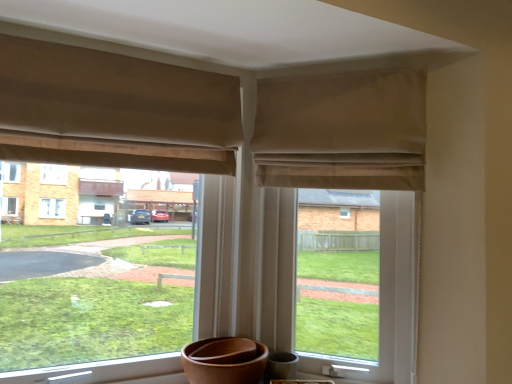
Where is `beige fabric curtain at upper left, the second curtain in the right-to-left sequence`? Image resolution: width=512 pixels, height=384 pixels. beige fabric curtain at upper left, the second curtain in the right-to-left sequence is located at coordinates (219, 116).

Locate an element on the screen. This screenshot has height=384, width=512. beige fabric curtain at upper center, which is counted as the first curtain, starting from the right is located at coordinates (341, 131).

Image resolution: width=512 pixels, height=384 pixels. Find the location of `beige fabric window at center`. beige fabric window at center is located at coordinates (99, 311).

What's the angular difference between beige fabric at upper center and beige fabric curtain at upper left, which appears as the 1th curtain when viewed from the left,'s facing directions?

The angular difference between beige fabric at upper center and beige fabric curtain at upper left, which appears as the 1th curtain when viewed from the left, is 45.4 degrees.

In order to click on curtain that is the 2nd object located above the beige fabric at upper center (from the image's perspective) in this screenshot , I will do `click(219, 116)`.

Considering the sizes of objects beige fabric at upper center and beige fabric curtain at upper left, which appears as the 1th curtain when viewed from the left, in the image provided, who is bigger, beige fabric at upper center or beige fabric curtain at upper left, which appears as the 1th curtain when viewed from the left,?

With larger size is beige fabric at upper center.

Is beige fabric at upper center positioned before beige fabric curtain at upper left, which appears as the 1th curtain when viewed from the left?

No.

Is point (362, 287) positioned behind point (380, 136)?

Yes, it is.

You are a GUI agent. You are given a task and a screenshot of the screen. Output one action in this format:
    pyautogui.click(x=<x>, y=<y>)
    Task: Click on the window screen beneath the beige fabric curtain at upper center, which is counted as the first curtain, starting from the right (from a real-world perspective)
    The height and width of the screenshot is (384, 512).
    Given the screenshot: What is the action you would take?
    click(x=341, y=259)

Is beige fabric at upper center oriented away from beige fabric curtain at upper center, which is counted as the first curtain, starting from the right?

Correct, beige fabric at upper center is looking away from beige fabric curtain at upper center, which is counted as the first curtain, starting from the right.

Is beige fabric at upper center beside beige fabric window at center?

No.

Consider the image. Do you think beige fabric at upper center is within beige fabric window at center, or outside of it?

beige fabric at upper center is not enclosed by beige fabric window at center.

From the image's perspective, between beige fabric at upper center and beige fabric window at center, who is located below?

beige fabric at upper center appears lower in the image.

From a real-world perspective, between beige fabric at upper center and beige fabric window at center, who is vertically lower?

In real-world perspective, beige fabric window at center is lower.

From the image's perspective, is beige fabric curtain at upper center, which is counted as the first curtain, starting from the right, above beige fabric window at center?

Indeed, from the image's perspective, beige fabric curtain at upper center, which is counted as the first curtain, starting from the right, is shown above beige fabric window at center.

Can you tell me how much beige fabric curtain at upper center, which is counted as the first curtain, starting from the right, and beige fabric window at center differ in facing direction?

They differ by 44.7 degrees in their facing directions.

Considering the sizes of objects beige fabric curtain at upper center, which is the 2th curtain in left-to-right order, and beige fabric window at center in the image provided, who is thinner, beige fabric curtain at upper center, which is the 2th curtain in left-to-right order, or beige fabric window at center?

beige fabric curtain at upper center, which is the 2th curtain in left-to-right order.

Is point (370, 112) closer or farther from the camera than point (33, 147)?

Point (370, 112).

Considering the sizes of objects beige fabric curtain at upper left, the second curtain in the right-to-left sequence, and beige fabric window at center in the image provided, who is shorter, beige fabric curtain at upper left, the second curtain in the right-to-left sequence, or beige fabric window at center?

beige fabric curtain at upper left, the second curtain in the right-to-left sequence, is shorter.

Considering the relative sizes of beige fabric curtain at upper left, the second curtain in the right-to-left sequence, and beige fabric window at center in the image provided, is beige fabric curtain at upper left, the second curtain in the right-to-left sequence, thinner than beige fabric window at center?

Yes, beige fabric curtain at upper left, the second curtain in the right-to-left sequence, is thinner than beige fabric window at center.

Is beige fabric curtain at upper left, the second curtain in the right-to-left sequence, not inside beige fabric window at center?

Indeed, beige fabric curtain at upper left, the second curtain in the right-to-left sequence, is completely outside beige fabric window at center.

Could you measure the distance between beige fabric curtain at upper left, which appears as the 1th curtain when viewed from the left, and beige fabric window at center?

They are 37.84 inches apart.

Is beige fabric window at center far away from beige fabric curtain at upper center, which is the 2th curtain in left-to-right order?

No, there isn't a large distance between beige fabric window at center and beige fabric curtain at upper center, which is the 2th curtain in left-to-right order.

From the image's perspective, who appears lower, beige fabric window at center or beige fabric curtain at upper center, which is the 2th curtain in left-to-right order?

beige fabric window at center, from the image's perspective.

Is beige fabric window at center inside the boundaries of beige fabric curtain at upper center, which is the 2th curtain in left-to-right order, or outside?

beige fabric window at center exists outside the volume of beige fabric curtain at upper center, which is the 2th curtain in left-to-right order.

Does point (52, 149) come in front of point (387, 134)?

Yes, it is.

Based on the photo, from the image's perspective, is beige fabric curtain at upper left, which appears as the 1th curtain when viewed from the left, on beige fabric curtain at upper center, which is counted as the first curtain, starting from the right?

Yes, from the image's perspective, beige fabric curtain at upper left, which appears as the 1th curtain when viewed from the left, is over beige fabric curtain at upper center, which is counted as the first curtain, starting from the right.

Between point (188, 161) and point (345, 73), which one is positioned behind?

The point (345, 73) is farther.

Is beige fabric curtain at upper left, which appears as the 1th curtain when viewed from the left, facing away from beige fabric curtain at upper center, which is counted as the first curtain, starting from the right?

That's not correct — beige fabric curtain at upper left, which appears as the 1th curtain when viewed from the left, is not looking away from beige fabric curtain at upper center, which is counted as the first curtain, starting from the right.

You are a GUI agent. You are given a task and a screenshot of the screen. Output one action in this format:
    pyautogui.click(x=<x>, y=<y>)
    Task: Click on the curtain lying above the beige fabric curtain at upper center, which is the 2th curtain in left-to-right order (from the image's perspective)
    Image resolution: width=512 pixels, height=384 pixels.
    Given the screenshot: What is the action you would take?
    pyautogui.click(x=219, y=116)

In order to click on window screen beneath the beige fabric curtain at upper left, which appears as the 1th curtain when viewed from the left (from a real-world perspective) in this screenshot , I will do `click(341, 259)`.

Identify the location of the 1st curtain to the left of the beige fabric at upper center, counting from the anchor's position. The height and width of the screenshot is (384, 512). (341, 131).

Estimate the real-world distances between objects in this image. Which object is further from beige fabric curtain at upper left, which appears as the 1th curtain when viewed from the left, beige fabric window at center or beige fabric curtain at upper center, which is the 2th curtain in left-to-right order?

Based on the image, beige fabric window at center appears to be further to beige fabric curtain at upper left, which appears as the 1th curtain when viewed from the left.

Looking at this image, estimate the real-world distances between objects in this image. Which object is further from beige fabric at upper center, beige fabric window at center or beige fabric curtain at upper center, which is the 2th curtain in left-to-right order?

Among the two, beige fabric window at center is located further to beige fabric at upper center.

Based on their spatial positions, is beige fabric curtain at upper left, the second curtain in the right-to-left sequence, or beige fabric window at center closer to beige fabric curtain at upper center, which is counted as the first curtain, starting from the right?

beige fabric curtain at upper left, the second curtain in the right-to-left sequence, lies closer to beige fabric curtain at upper center, which is counted as the first curtain, starting from the right, than the other object.

Considering their positions, is beige fabric curtain at upper left, the second curtain in the right-to-left sequence, positioned closer to beige fabric curtain at upper center, which is the 2th curtain in left-to-right order, than beige fabric at upper center?

beige fabric curtain at upper left, the second curtain in the right-to-left sequence.

Estimate the real-world distances between objects in this image. Which object is closer to beige fabric at upper center, beige fabric curtain at upper left, the second curtain in the right-to-left sequence, or beige fabric window at center?

beige fabric curtain at upper left, the second curtain in the right-to-left sequence.

Looking at the image, which one is located closer to beige fabric window at center, beige fabric at upper center or beige fabric curtain at upper center, which is counted as the first curtain, starting from the right?

The object closer to beige fabric window at center is beige fabric at upper center.

Looking at the image, which one is located closer to beige fabric curtain at upper left, the second curtain in the right-to-left sequence, beige fabric curtain at upper center, which is counted as the first curtain, starting from the right, or beige fabric at upper center?

beige fabric curtain at upper center, which is counted as the first curtain, starting from the right, is closer to beige fabric curtain at upper left, the second curtain in the right-to-left sequence.

From the image, which object appears to be farther from beige fabric window at center, beige fabric curtain at upper center, which is the 2th curtain in left-to-right order, or beige fabric curtain at upper left, which appears as the 1th curtain when viewed from the left?

beige fabric curtain at upper center, which is the 2th curtain in left-to-right order.

The image size is (512, 384). Identify the location of curtain between beige fabric window at center and beige fabric curtain at upper center, which is counted as the first curtain, starting from the right. pyautogui.click(x=219, y=116).

Locate an element on the screen. curtain situated between beige fabric curtain at upper left, which appears as the 1th curtain when viewed from the left, and beige fabric at upper center from left to right is located at coordinates (x=341, y=131).